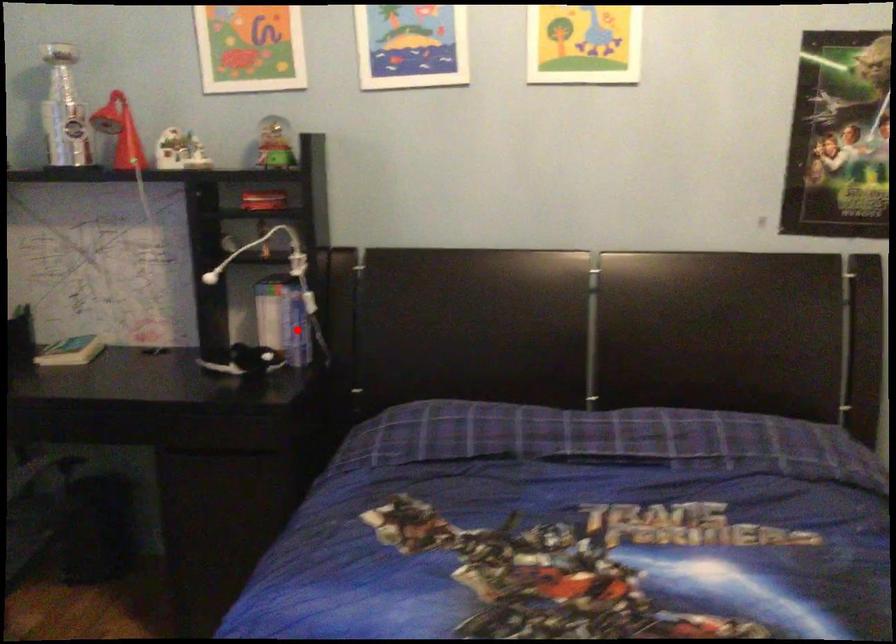
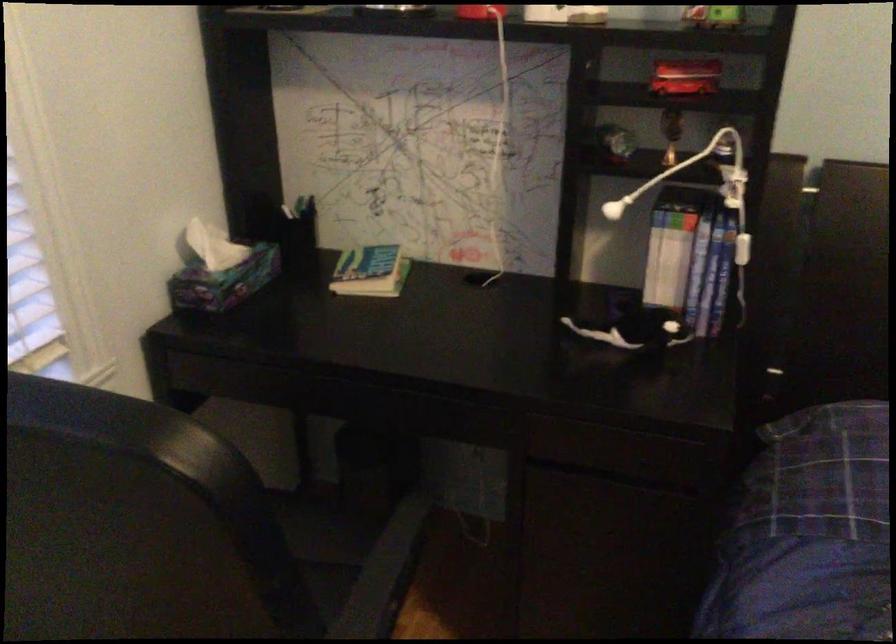
In the second image, find the point that corresponds to the highlighted location in the first image.

(707, 288)